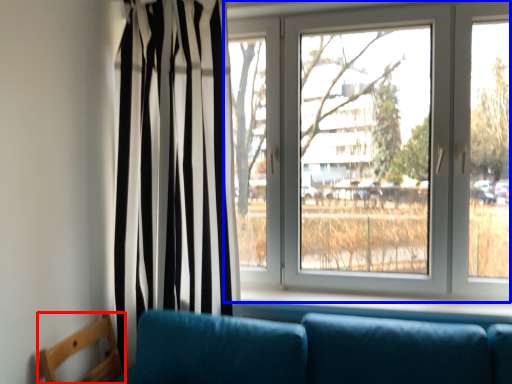
Question: Which point is further to the camera, furniture (highlighted by a red box) or window (highlighted by a blue box)?

Choices:
 (A) furniture
 (B) window

Answer: (B)